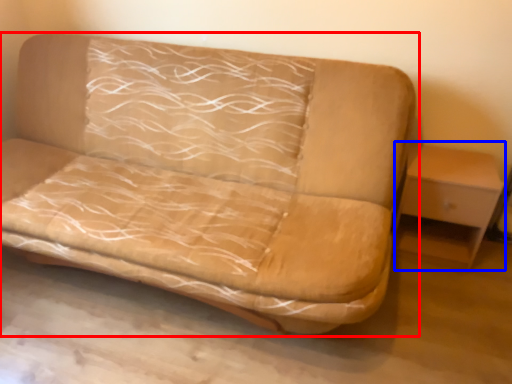
Question: Which object is further to the camera taking this photo, studio couch (highlighted by a red box) or table (highlighted by a blue box)?

Choices:
 (A) studio couch
 (B) table

Answer: (B)